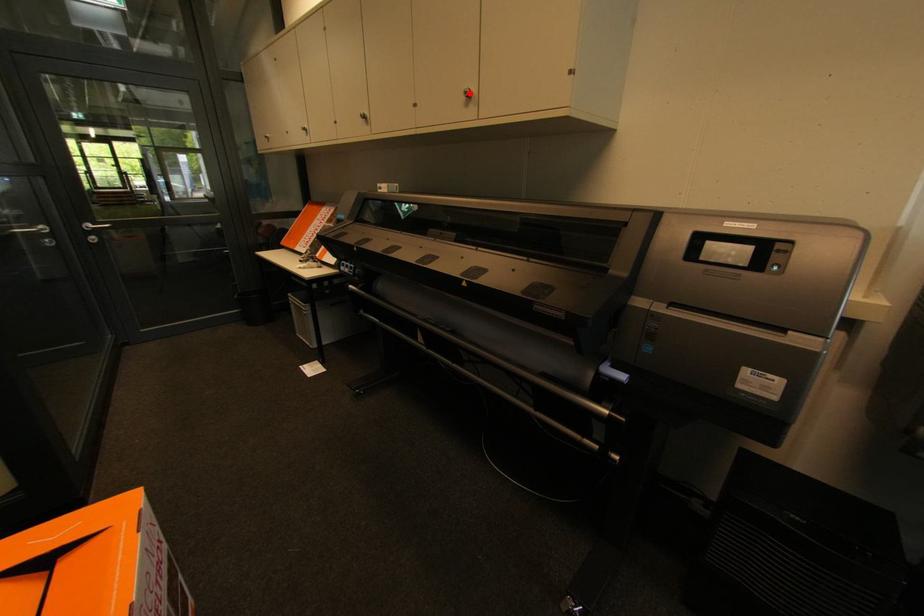
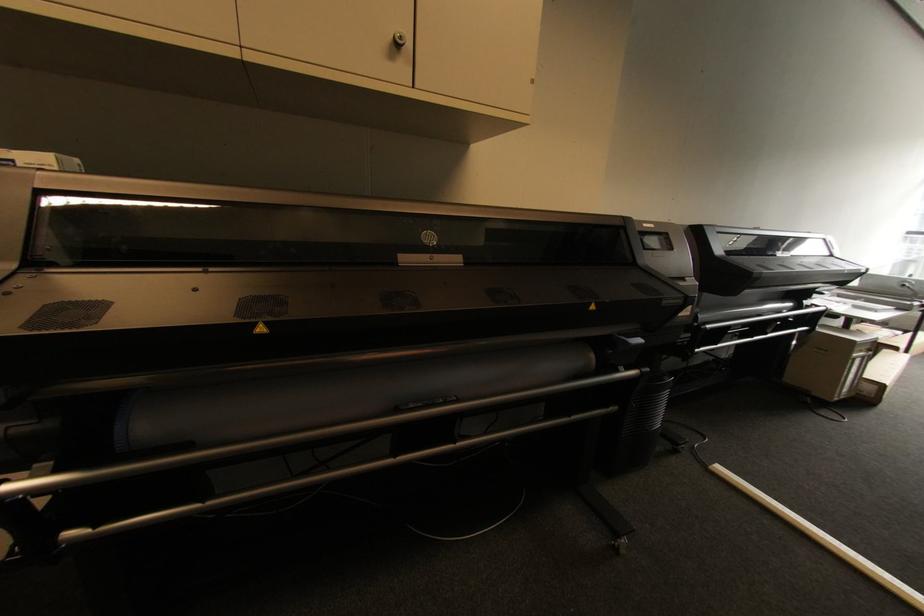
Where in the second image is the point corresponding to the highlighted location from the first image?

(405, 38)